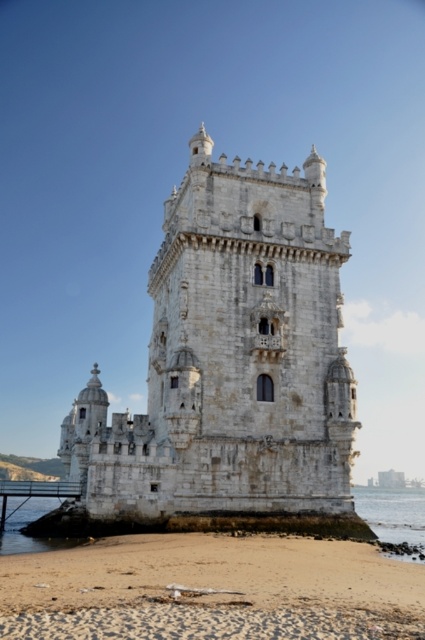
Is white stone tower at center positioned before sandy beach at lower center?

No, it is not.

Does white stone tower at center appear over sandy beach at lower center?

Yes, white stone tower at center is above sandy beach at lower center.

Describe the element at coordinates (231, 358) in the screenshot. I see `white stone tower at center` at that location.

Locate an element on the screen. This screenshot has height=640, width=425. white stone tower at center is located at coordinates (231, 358).

Is sandy beach at lower center shorter than clear water at lower right?

Correct, sandy beach at lower center is not as tall as clear water at lower right.

Is point (50, 605) behind point (419, 536)?

No, it is in front of (419, 536).

This screenshot has height=640, width=425. Identify the location of sandy beach at lower center. (210, 589).

Which is more to the right, white stone tower at center or clear water at lower right?

From the viewer's perspective, clear water at lower right appears more on the right side.

At what (x,y) coordinates should I click in order to perform the action: click on white stone tower at center. Please return your answer as a coordinate pair (x, y). The width and height of the screenshot is (425, 640). Looking at the image, I should click on (231, 358).

Which is behind, point (257, 209) or point (385, 508)?

Point (385, 508)

Image resolution: width=425 pixels, height=640 pixels. Identify the location of white stone tower at center. (231, 358).